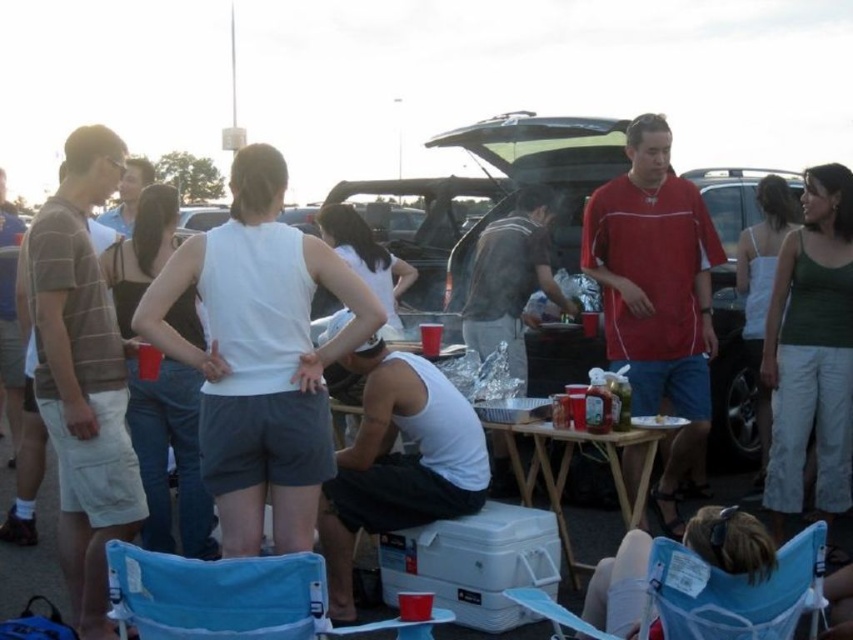
You are at a tailgate party and want to find the brown striped shirt at left. Which direction should you look relative to the red jersey at center?

The brown striped shirt at left is located below the red jersey at center, so you should look downward from the red jersey at center to find it.

Looking at this image, you are standing at the camera position and want to throw a frisbee to someone. There are two points marked in the image, point A at coordinates point [299,618] and point B at coordinates point [676,561]. Which point is closer to you?

Point A at coordinates point [299,618] is closer to the viewer than point B at coordinates point [676,561].

You are at a tailgate party and want to greet the person wearing the white matte tank top at center and the dark gray fabric shirt at center. Which one should you approach first if you are standing to the right of both?

You should approach the white matte tank top at center first because it is to the left of the dark gray fabric shirt at center, so it is closer to your position on the right.